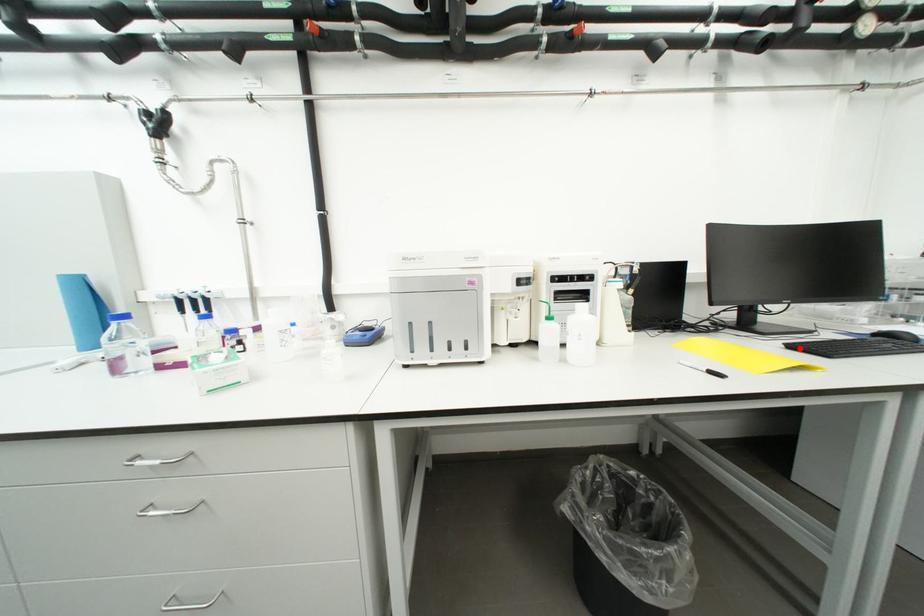
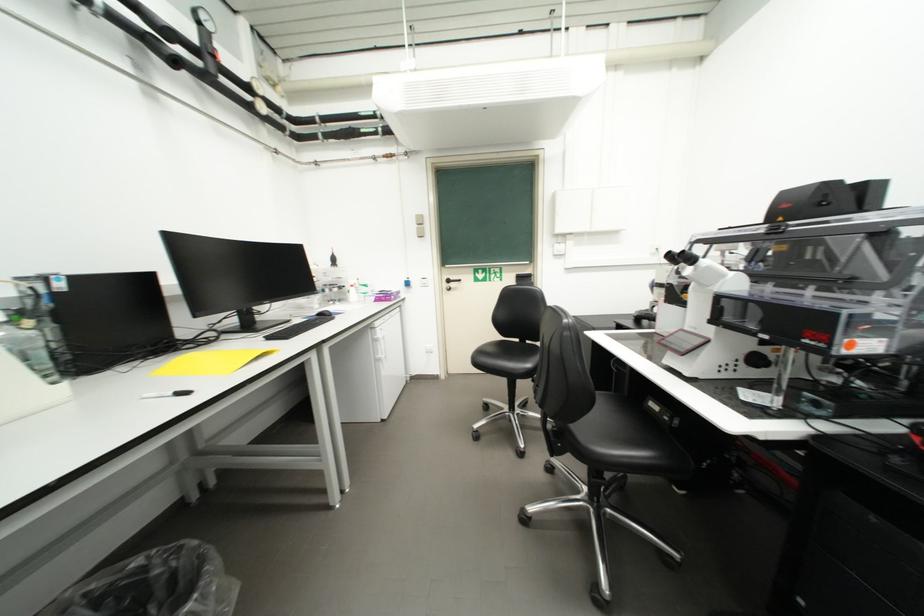
Where in the second image is the point corresponding to the highlighted location from the first image?

(276, 339)